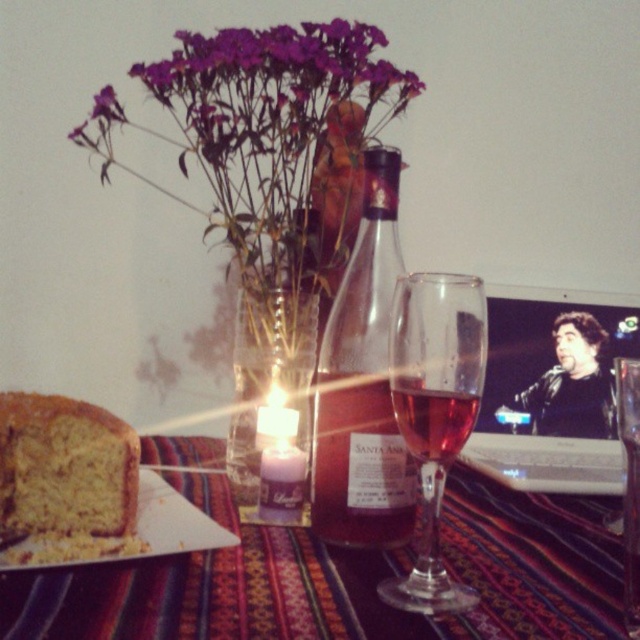
Question: Which object appears closest to the camera in this image?

Choices:
 (A) rosy glass at center
 (B) translucent glass santa ana wine at center
 (C) golden crumbly bread at lower left

Answer: (A)

Question: Does golden crumbly bread at lower left appear under rosy glass at center?

Choices:
 (A) yes
 (B) no

Answer: (A)

Question: Which object is the closest to the pink glass at center?

Choices:
 (A) translucent glass santa ana wine at center
 (B) rosy glass at center

Answer: (B)

Question: Is golden crumbly bread at lower left further to the viewer compared to translucent glass santa ana wine at center?

Choices:
 (A) yes
 (B) no

Answer: (B)

Question: Is matte glass bottle at center wider than rosy glass at center?

Choices:
 (A) no
 (B) yes

Answer: (B)

Question: Among these points, which one is farthest from the camera?

Choices:
 (A) (330, 310)
 (B) (38, 428)

Answer: (A)